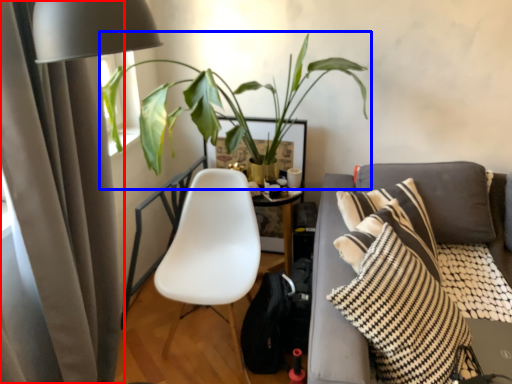
Question: Which object is closer to the camera taking this photo, curtain (highlighted by a red box) or houseplant (highlighted by a blue box)?

Choices:
 (A) curtain
 (B) houseplant

Answer: (A)